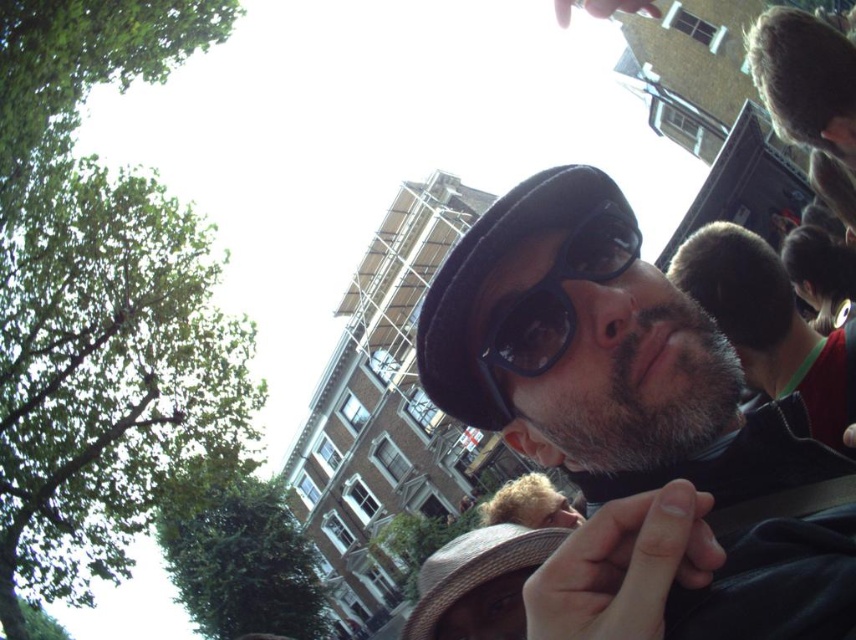
Measure the distance between matte black hat at center and gray fuzzy hat at upper right.

matte black hat at center and gray fuzzy hat at upper right are 12.31 meters apart from each other.

Between point (597, 419) and point (833, 397), which one is positioned behind?

Positioned behind is point (833, 397).

Which is in front, point (595, 449) or point (758, 388)?

Point (595, 449) is more forward.

In order to click on matte black hat at center in this screenshot , I will do `click(599, 355)`.

Is gray fuzzy hat at upper right in front of blonde hair at center?

Yes, it is in front of blonde hair at center.

Between gray fuzzy hat at upper right and blonde hair at center, which one has more height?

gray fuzzy hat at upper right

Between point (770, 289) and point (490, 518), which one is positioned behind?

The point (490, 518) is behind.

In order to click on gray fuzzy hat at upper right in this screenshot , I will do `click(765, 323)`.

Identify the location of gray fuzzy hat at upper right. Image resolution: width=856 pixels, height=640 pixels. (765, 323).

Is point (684, 253) farther from camera compared to point (525, 312)?

Yes, point (684, 253) is farther from viewer.

This screenshot has width=856, height=640. Find the location of `gray fuzzy hat at upper right`. gray fuzzy hat at upper right is located at coordinates (765, 323).

You are a GUI agent. You are given a task and a screenshot of the screen. Output one action in this format:
    pyautogui.click(x=<x>, y=<y>)
    Task: Click on the gray fuzzy hat at upper right
    This screenshot has height=640, width=856.
    Given the screenshot: What is the action you would take?
    pyautogui.click(x=765, y=323)